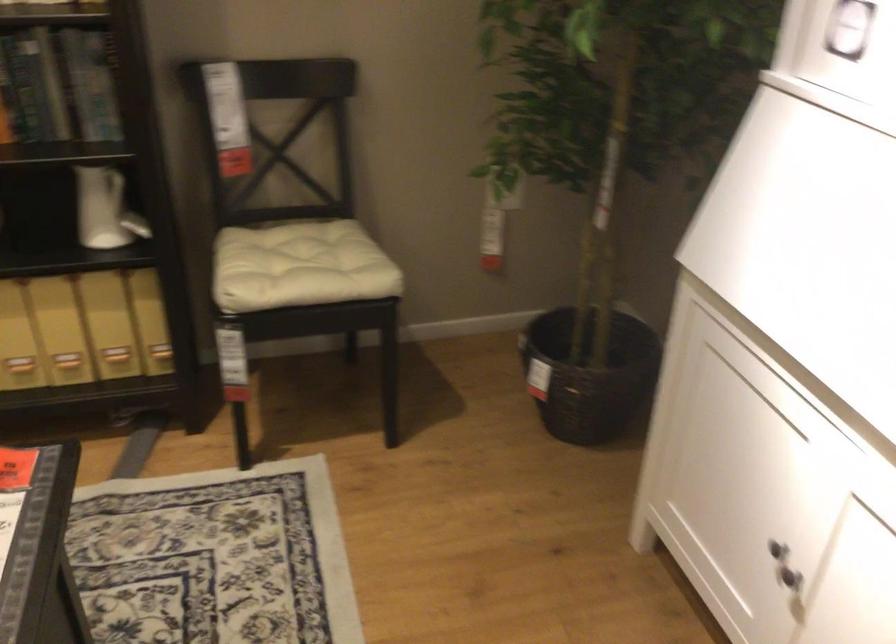
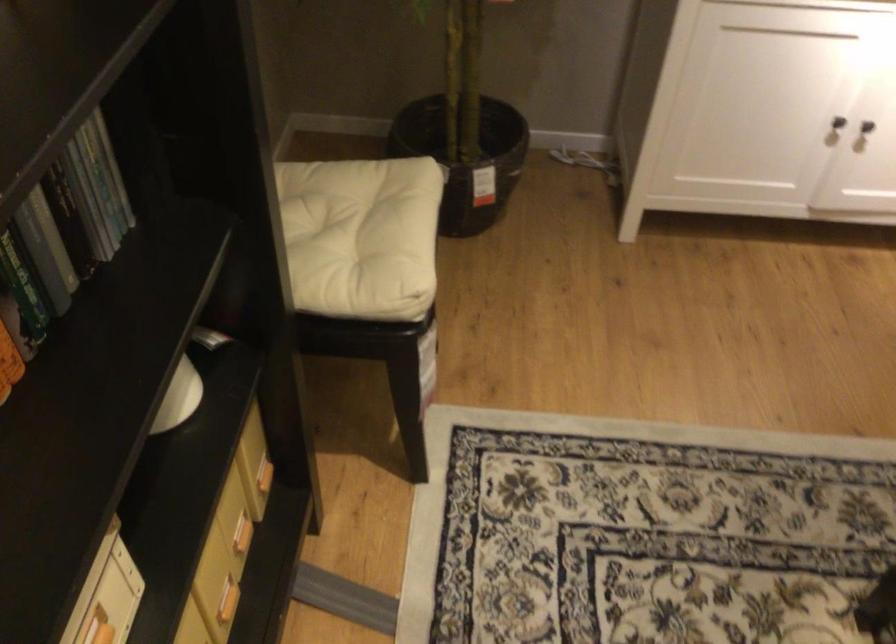
In the second image, find the point that corresponds to pixel 312 270 in the first image.

(355, 234)